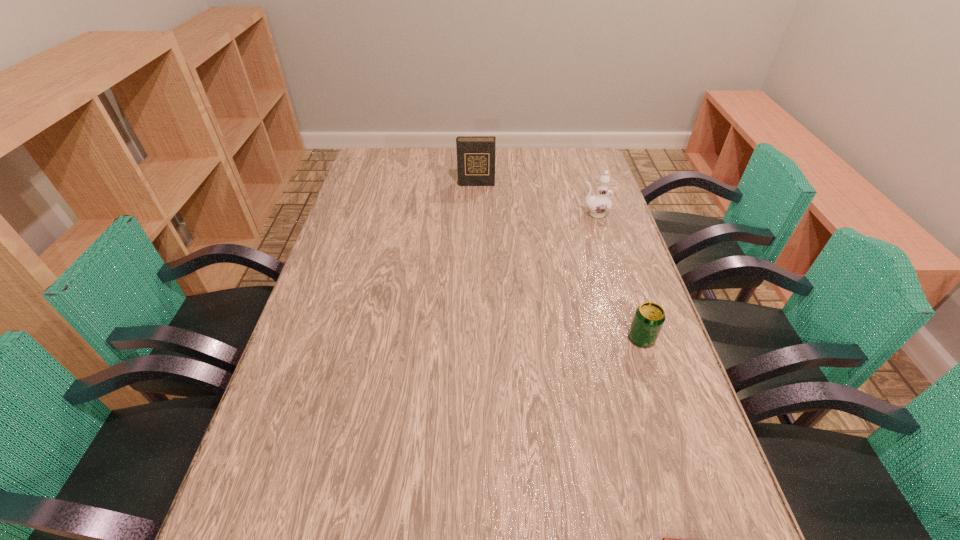
Where is `unoccupied position between the second nearest object and the farthest object`? The height and width of the screenshot is (540, 960). unoccupied position between the second nearest object and the farthest object is located at coordinates (559, 261).

Locate which object is the closest to the taller diary. Please provide its 2D coordinates. Your answer should be formatted as a tuple, i.e. [(x, y)], where the tuple contains the x and y coordinates of a point satisfying the conditions above.

[(599, 204)]

The image size is (960, 540). I want to click on object that stands as the closest to the third tallest object, so click(664, 539).

You are a GUI agent. You are given a task and a screenshot of the screen. Output one action in this format:
    pyautogui.click(x=<x>, y=<y>)
    Task: Click on the vacant space that satisfies the following two spatial constraints: 1. at the spout of the third tallest object; 2. on the right side of the chinaware
    
    Given the screenshot: What is the action you would take?
    pyautogui.click(x=634, y=338)

The image size is (960, 540). I want to click on free spot that satisfies the following two spatial constraints: 1. on the front cover of the third tallest object; 2. on the left side of the taller diary, so click(474, 338).

The image size is (960, 540). Identify the location of vacant area in the image that satisfies the following two spatial constraints: 1. on the back side of the second nearest object; 2. at the spout of the chinaware. (600, 214).

This screenshot has width=960, height=540. I want to click on vacant position in the image that satisfies the following two spatial constraints: 1. at the spout of the chinaware; 2. on the back side of the third farthest object, so click(634, 338).